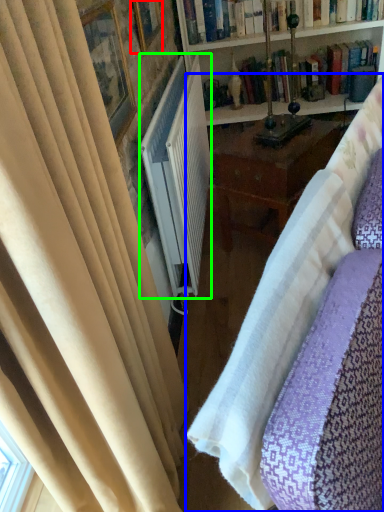
Question: Estimate the real-world distances between objects in this image. Which object is closer to picture frame (highlighted by a red box), studio couch (highlighted by a blue box) or radiator (highlighted by a green box)?

Choices:
 (A) studio couch
 (B) radiator

Answer: (B)